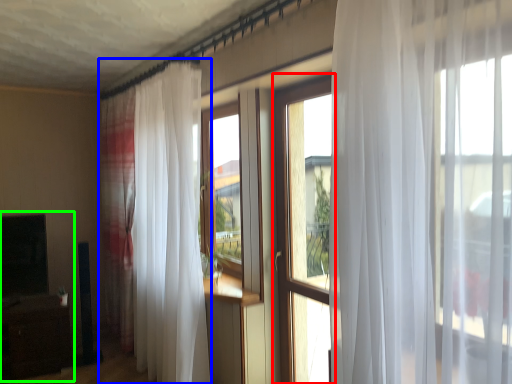
Question: Which object is positioned farthest from window (highlighted by a red box)? Select from curtain (highlighted by a blue box) and entertainment center (highlighted by a green box).

Choices:
 (A) curtain
 (B) entertainment center

Answer: (B)